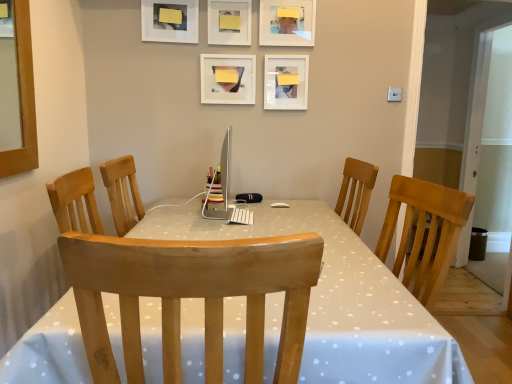
Identify the location of matte plastic picture frame at upper center, positioned as the 2th picture frame in left-to-right order. (228, 79).

I want to click on white matte picture frame at upper center, the 2th picture frame viewed from the right, so click(x=286, y=82).

Identify the location of white glossy table at center. (339, 300).

Locate an element on the screen. matte plastic picture frame at upper center, positioned as the 2th picture frame in left-to-right order is located at coordinates (228, 79).

Looking at this image, considering the relative positions of light wood chair at center and white matte picture frame at upper center, the 2th picture frame viewed from the right, in the image provided, is light wood chair at center to the right of white matte picture frame at upper center, the 2th picture frame viewed from the right, from the viewer's perspective?

In fact, light wood chair at center is to the left of white matte picture frame at upper center, the 2th picture frame viewed from the right.

Is light wood chair at center next to white matte picture frame at upper center, the 2th picture frame viewed from the right, and touching it?

No, light wood chair at center is not next to white matte picture frame at upper center, the 2th picture frame viewed from the right.

From the image's perspective, who appears lower, light wood chair at center or white matte picture frame at upper center, acting as the fourth picture frame starting from the left?

light wood chair at center is shown below in the image.

Measure the distance between light wood chair at center and white matte picture frame at upper center, the 2th picture frame viewed from the right.

light wood chair at center and white matte picture frame at upper center, the 2th picture frame viewed from the right, are 6.22 feet apart.

Would you say light wood chair at center is to the left or to the right of matte white picture frame at upper center, the 1th picture frame viewed from the left, in the picture?

In the image, light wood chair at center appears on the right side of matte white picture frame at upper center, the 1th picture frame viewed from the left.

In the scene shown: Considering the positions of objects light wood chair at center and matte white picture frame at upper center, the 5th picture frame viewed from the right, in the image provided, who is behind, light wood chair at center or matte white picture frame at upper center, the 5th picture frame viewed from the right,?

matte white picture frame at upper center, the 5th picture frame viewed from the right, is more distant.

Consider the image. Is light wood chair at center not within matte white picture frame at upper center, the 5th picture frame viewed from the right?

light wood chair at center is positioned outside matte white picture frame at upper center, the 5th picture frame viewed from the right.

Looking at the image, does light wood chair at center seem bigger or smaller compared to matte white picture frame at upper center, the 5th picture frame viewed from the right?

In the image, light wood chair at center appears to be larger than matte white picture frame at upper center, the 5th picture frame viewed from the right.

Can you confirm if light wood chair at center is shorter than white matte picture frame at upper center, placed as the 3th picture frame when sorted from right to left?

No, light wood chair at center is not shorter than white matte picture frame at upper center, placed as the 3th picture frame when sorted from right to left.

Considering their positions, is light wood chair at center located in front of or behind white matte picture frame at upper center, placed as the 3th picture frame when sorted from right to left?

Clearly, light wood chair at center is in front of white matte picture frame at upper center, placed as the 3th picture frame when sorted from right to left.

Considering the points (177, 337) and (224, 13), which point is behind, point (177, 337) or point (224, 13)?

The point (224, 13) is behind.

Is light wood chair at center inside or outside of white matte picture frame at upper center, placed as the 3th picture frame when sorted from right to left?

light wood chair at center exists outside the volume of white matte picture frame at upper center, placed as the 3th picture frame when sorted from right to left.

The height and width of the screenshot is (384, 512). I want to click on picture frame that is the 2nd object to the left of the white glossy table at center, starting at the anchor, so click(228, 79).

From a real-world perspective, is white glossy table at center positioned over matte plastic picture frame at upper center, which is the fourth picture frame in right-to-left order, based on gravity?

No.

Can you confirm if white glossy table at center is smaller than matte plastic picture frame at upper center, which is the fourth picture frame in right-to-left order?

No, white glossy table at center is not smaller than matte plastic picture frame at upper center, which is the fourth picture frame in right-to-left order.

From the picture: Does light wood chair at center appear on the left side of matte white picture frame at upper center, placed as the 5th picture frame when sorted from left to right?

Indeed, light wood chair at center is positioned on the left side of matte white picture frame at upper center, placed as the 5th picture frame when sorted from left to right.

At what (x,y) coordinates should I click in order to perform the action: click on chair lying in front of the matte white picture frame at upper center, positioned as the 1th picture frame in right-to-left order. Please return your answer as a coordinate pair (x, y). This screenshot has height=384, width=512. Looking at the image, I should click on (191, 297).

Consider the image. Considering the sizes of light wood chair at center and matte white picture frame at upper center, positioned as the 1th picture frame in right-to-left order, in the image, is light wood chair at center wider or thinner than matte white picture frame at upper center, positioned as the 1th picture frame in right-to-left order,?

In the image, light wood chair at center appears to be wider than matte white picture frame at upper center, positioned as the 1th picture frame in right-to-left order.

How different are the orientations of light wood chair at center and matte white picture frame at upper center, placed as the 5th picture frame when sorted from left to right, in degrees?

The angle between the facing direction of light wood chair at center and the facing direction of matte white picture frame at upper center, placed as the 5th picture frame when sorted from left to right, is 180 degrees.

In the scene shown: Is white matte picture frame at upper center, the 3th picture frame from the left, in front of or behind matte white picture frame at upper center, the 5th picture frame viewed from the right, in the image?

Visually, white matte picture frame at upper center, the 3th picture frame from the left, is located behind matte white picture frame at upper center, the 5th picture frame viewed from the right.

Who is smaller, white matte picture frame at upper center, the 3th picture frame from the left, or matte white picture frame at upper center, the 5th picture frame viewed from the right?

white matte picture frame at upper center, the 3th picture frame from the left.

From a real-world perspective, is white matte picture frame at upper center, placed as the 3th picture frame when sorted from right to left, positioned under matte white picture frame at upper center, the 1th picture frame viewed from the left, based on gravity?

Correct, in the physical world, white matte picture frame at upper center, placed as the 3th picture frame when sorted from right to left, is lower than matte white picture frame at upper center, the 1th picture frame viewed from the left.

Could you tell me if white matte picture frame at upper center, the 3th picture frame from the left, is turned towards matte white picture frame at upper center, the 5th picture frame viewed from the right?

No.

From a real-world perspective, does matte white picture frame at upper center, placed as the 5th picture frame when sorted from left to right, sit lower than matte plastic picture frame at upper center, which is the fourth picture frame in right-to-left order?

No, from a real-world perspective, matte white picture frame at upper center, placed as the 5th picture frame when sorted from left to right, is not below matte plastic picture frame at upper center, which is the fourth picture frame in right-to-left order.

Are matte white picture frame at upper center, placed as the 5th picture frame when sorted from left to right, and matte plastic picture frame at upper center, positioned as the 2th picture frame in left-to-right order, making contact?

No, matte white picture frame at upper center, placed as the 5th picture frame when sorted from left to right, is not with matte plastic picture frame at upper center, positioned as the 2th picture frame in left-to-right order.

From the picture: Which object is wider, matte white picture frame at upper center, placed as the 5th picture frame when sorted from left to right, or matte plastic picture frame at upper center, positioned as the 2th picture frame in left-to-right order?

matte white picture frame at upper center, placed as the 5th picture frame when sorted from left to right.

This screenshot has height=384, width=512. Find the location of `chair lying below the white matte picture frame at upper center, acting as the fourth picture frame starting from the left (from the image's perspective)`. chair lying below the white matte picture frame at upper center, acting as the fourth picture frame starting from the left (from the image's perspective) is located at coordinates (191, 297).

From the light wood chair at center, count the 3rd picture frame to the left and point to it. Please provide its 2D coordinates.

[(169, 21)]

Considering their positions, is matte plastic picture frame at upper center, which is the fourth picture frame in right-to-left order, positioned further to white matte picture frame at upper center, placed as the 3th picture frame when sorted from right to left, than light wood chair at center?

light wood chair at center is further to white matte picture frame at upper center, placed as the 3th picture frame when sorted from right to left.

From the image, which object appears to be nearer to matte plastic picture frame at upper center, positioned as the 2th picture frame in left-to-right order, light wood chair at center or matte white picture frame at upper center, placed as the 5th picture frame when sorted from left to right?

matte white picture frame at upper center, placed as the 5th picture frame when sorted from left to right, is closer to matte plastic picture frame at upper center, positioned as the 2th picture frame in left-to-right order.

Estimate the real-world distances between objects in this image. Which object is further from white glossy table at center, matte plastic picture frame at upper center, positioned as the 2th picture frame in left-to-right order, or white matte picture frame at upper center, the 2th picture frame viewed from the right?

white matte picture frame at upper center, the 2th picture frame viewed from the right, is positioned further to the anchor white glossy table at center.

Which object lies nearer to the anchor point white glossy table at center, matte plastic picture frame at upper center, which is the fourth picture frame in right-to-left order, or white matte picture frame at upper center, the 3th picture frame from the left?

matte plastic picture frame at upper center, which is the fourth picture frame in right-to-left order, is closer to white glossy table at center.

Which object lies nearer to the anchor point matte white picture frame at upper center, placed as the 5th picture frame when sorted from left to right, white matte picture frame at upper center, the 3th picture frame from the left, or matte white picture frame at upper center, the 1th picture frame viewed from the left?

white matte picture frame at upper center, the 3th picture frame from the left, is closer to matte white picture frame at upper center, placed as the 5th picture frame when sorted from left to right.

Based on their spatial positions, is matte plastic picture frame at upper center, positioned as the 2th picture frame in left-to-right order, or white matte picture frame at upper center, placed as the 3th picture frame when sorted from right to left, further from light wood chair at center?

white matte picture frame at upper center, placed as the 3th picture frame when sorted from right to left, is further to light wood chair at center.

When comparing their distances from matte plastic picture frame at upper center, which is the fourth picture frame in right-to-left order, does light wood chair at center or white matte picture frame at upper center, acting as the fourth picture frame starting from the left, seem further?

Based on the image, light wood chair at center appears to be further to matte plastic picture frame at upper center, which is the fourth picture frame in right-to-left order.

Estimate the real-world distances between objects in this image. Which object is closer to white matte picture frame at upper center, the 2th picture frame viewed from the right, matte plastic picture frame at upper center, which is the fourth picture frame in right-to-left order, or white glossy table at center?

The object closer to white matte picture frame at upper center, the 2th picture frame viewed from the right, is matte plastic picture frame at upper center, which is the fourth picture frame in right-to-left order.

This screenshot has width=512, height=384. What are the coordinates of `desk positioned between light wood chair at center and white matte picture frame at upper center, the 3th picture frame from the left, from near to far` in the screenshot? It's located at (339, 300).

Find the location of `picture frame between matte plastic picture frame at upper center, which is the fourth picture frame in right-to-left order, and white matte picture frame at upper center, the 2th picture frame viewed from the right, in the horizontal direction`. picture frame between matte plastic picture frame at upper center, which is the fourth picture frame in right-to-left order, and white matte picture frame at upper center, the 2th picture frame viewed from the right, in the horizontal direction is located at coordinates (229, 22).

The width and height of the screenshot is (512, 384). Find the location of `desk located between light wood chair at center and matte white picture frame at upper center, the 1th picture frame viewed from the left, in the depth direction`. desk located between light wood chair at center and matte white picture frame at upper center, the 1th picture frame viewed from the left, in the depth direction is located at coordinates (339, 300).

Where is `picture frame situated between matte white picture frame at upper center, the 1th picture frame viewed from the left, and white matte picture frame at upper center, placed as the 3th picture frame when sorted from right to left, from left to right`? The image size is (512, 384). picture frame situated between matte white picture frame at upper center, the 1th picture frame viewed from the left, and white matte picture frame at upper center, placed as the 3th picture frame when sorted from right to left, from left to right is located at coordinates (228, 79).